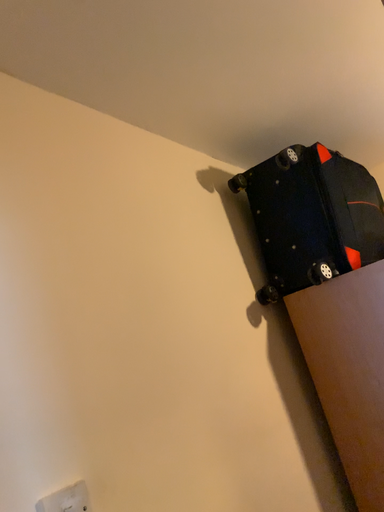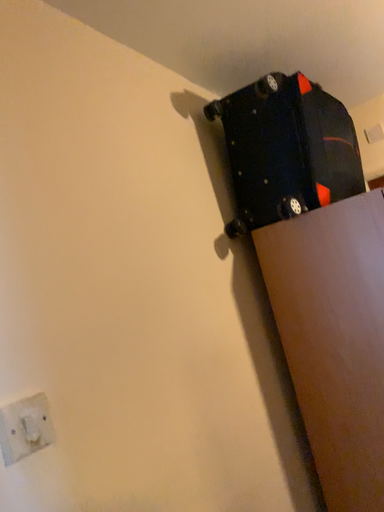
Question: How did the camera likely rotate when shooting the video?

Choices:
 (A) rotated upward
 (B) rotated downward

Answer: (B)